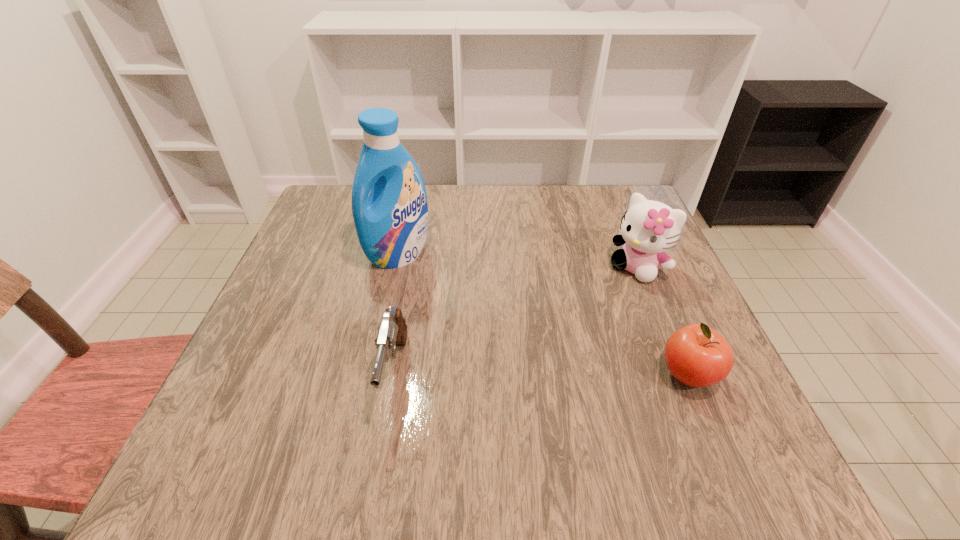
You are a GUI agent. You are given a task and a screenshot of the screen. Output one action in this format:
    pyautogui.click(x=<x>, y=<y>)
    Task: Click on the vacant space situated 0.310m on the front-facing side of the third shortest object
    This screenshot has height=540, width=960.
    Given the screenshot: What is the action you would take?
    pyautogui.click(x=540, y=360)

Where is `pistol situated at the near edge`? pistol situated at the near edge is located at coordinates (392, 331).

Locate an element on the screen. This screenshot has height=540, width=960. apple positioned at the near edge is located at coordinates (696, 355).

Find the location of a particular element. This screenshot has width=960, height=540. apple positioned at the right edge is located at coordinates (696, 355).

You are a GUI agent. You are given a task and a screenshot of the screen. Output one action in this format:
    pyautogui.click(x=<x>, y=<y>)
    Task: Click on the kitten that is at the right edge
    This screenshot has width=960, height=540.
    Given the screenshot: What is the action you would take?
    pyautogui.click(x=648, y=228)

Find the location of a particular element. The width and height of the screenshot is (960, 540). object present at the near right corner is located at coordinates (696, 355).

Where is `free space at the far edge of the desktop`? free space at the far edge of the desktop is located at coordinates (531, 212).

The image size is (960, 540). In the image, there is a desktop. In order to click on vacant space at the left edge in this screenshot , I will do `click(319, 296)`.

Find the location of a particular element. free point at the right edge is located at coordinates (658, 327).

In the image, there is a desktop. Where is `free space at the near left corner`? free space at the near left corner is located at coordinates (246, 400).